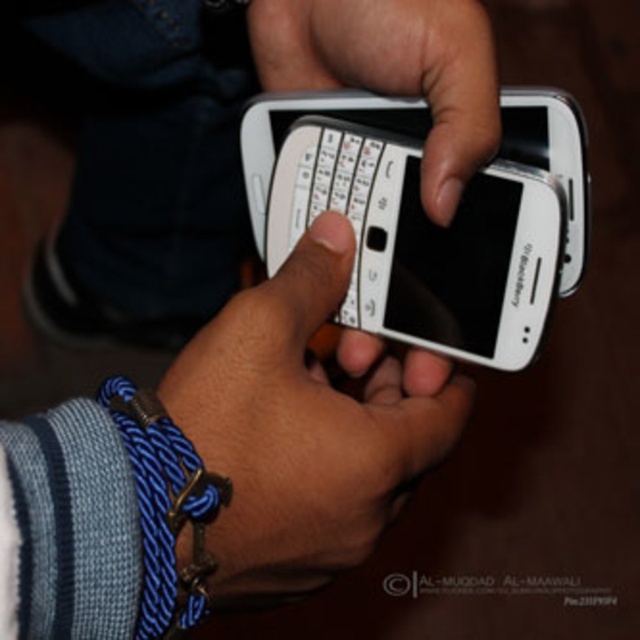
Is white matte phone at center smaller than white plastic phone at center?

Incorrect, white matte phone at center is not smaller in size than white plastic phone at center.

Is white matte phone at center closer to camera compared to white plastic phone at center?

Answer: Yes.

Who is more forward, (352, 449) or (477, 100)?

Point (352, 449) is more forward.

Identify the location of white matte phone at center. This screenshot has height=640, width=640. (305, 426).

Is white glossy phone at center further to camera compared to white matte phone at center?

Yes, it is.

Does white glossy phone at center appear on the left side of white matte phone at center?

In fact, white glossy phone at center is to the right of white matte phone at center.

Which is behind, point (323, 164) or point (237, 515)?

The point (323, 164) is behind.

In order to click on white glossy phone at center in this screenshot , I will do `click(424, 216)`.

In the scene shown: Does white matte phone at center have a greater height compared to blue braided cord at lower left?

Yes, white matte phone at center is taller than blue braided cord at lower left.

Can you confirm if white matte phone at center is wider than blue braided cord at lower left?

Correct, the width of white matte phone at center exceeds that of blue braided cord at lower left.

Who is more distant from viewer, (285, 298) or (173, 531)?

Positioned behind is point (285, 298).

You are a GUI agent. You are given a task and a screenshot of the screen. Output one action in this format:
    pyautogui.click(x=<x>, y=<y>)
    Task: Click on the white matte phone at center
    This screenshot has width=640, height=640.
    Given the screenshot: What is the action you would take?
    pyautogui.click(x=305, y=426)